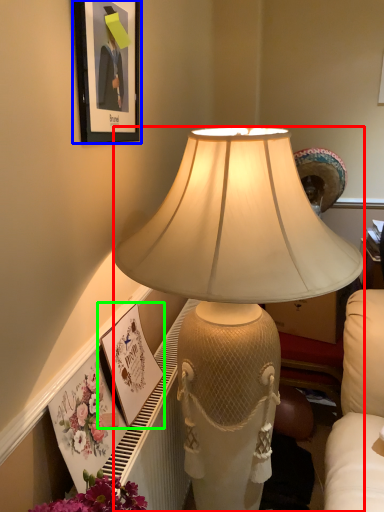
Question: Estimate the real-world distances between objects in this image. Which object is closer to lamp (highlighted by a red box), picture frame (highlighted by a blue box) or picture frame (highlighted by a green box)?

Choices:
 (A) picture frame
 (B) picture frame

Answer: (A)